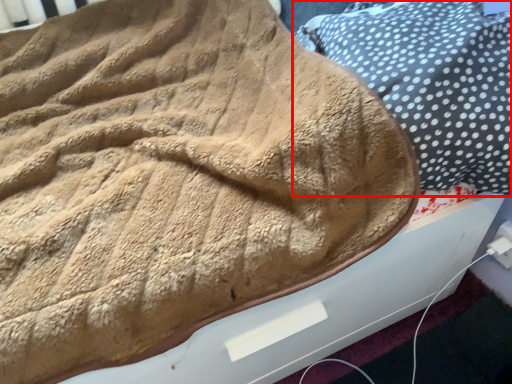
Question: From the image, what is the correct spatial relationship of pillow (annotated by the red box) in relation to electric outlet?

Choices:
 (A) right
 (B) left

Answer: (B)